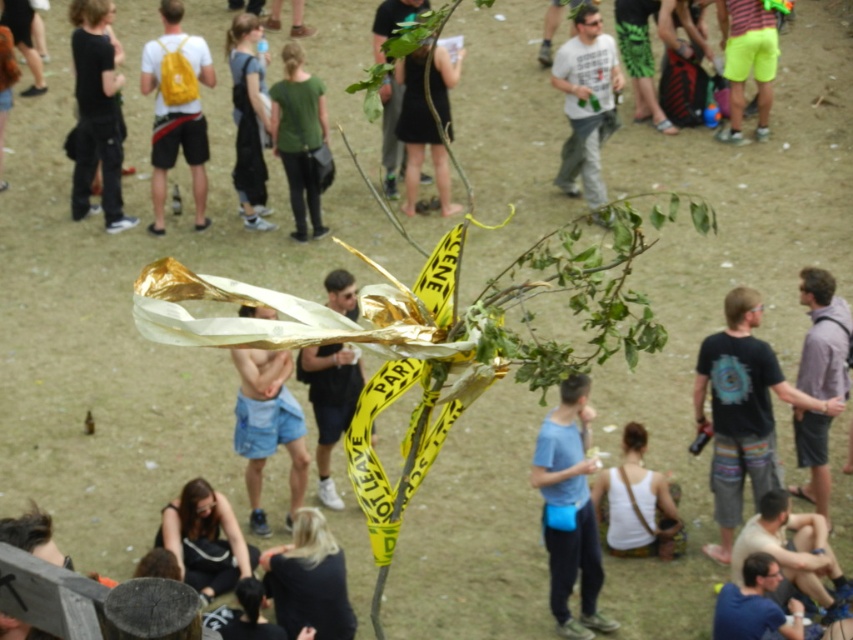
Between matte black backpack at left and neon yellow shorts at right, which one has less height?

Standing shorter between the two is neon yellow shorts at right.

Is matte black backpack at left in front of neon yellow shorts at right?

Yes, matte black backpack at left is in front of neon yellow shorts at right.

Image resolution: width=853 pixels, height=640 pixels. I want to click on matte black backpack at left, so click(x=96, y=113).

You are a GUI agent. You are given a task and a screenshot of the screen. Output one action in this format:
    pyautogui.click(x=<x>, y=<y>)
    Task: Click on the matte black backpack at left
    The height and width of the screenshot is (640, 853).
    Given the screenshot: What is the action you would take?
    click(96, 113)

Does blonde hair at lower center have a lesser height compared to matte black t-shirt at center?

Correct, blonde hair at lower center is not as tall as matte black t-shirt at center.

Locate an element on the screen. The height and width of the screenshot is (640, 853). blonde hair at lower center is located at coordinates (309, 579).

The width and height of the screenshot is (853, 640). Find the location of `blonde hair at lower center`. blonde hair at lower center is located at coordinates (309, 579).

In the scene shown: Can you confirm if light purple shirt at right is thinner than neon yellow shorts at right?

Yes.

Is light purple shirt at right closer to the viewer compared to neon yellow shorts at right?

Yes.

Does point (816, 339) come farther from viewer compared to point (756, 138)?

No, it is in front of (756, 138).

Where is `light purple shirt at right`? The width and height of the screenshot is (853, 640). light purple shirt at right is located at coordinates (822, 337).